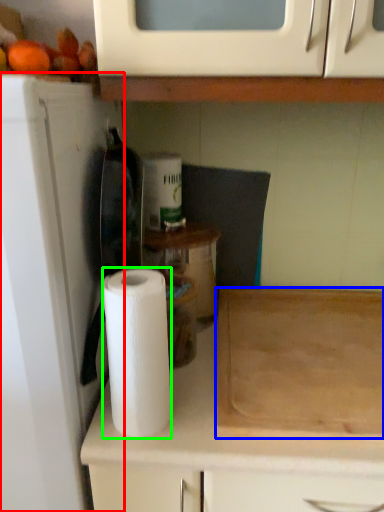
Question: Based on their relative distances, which object is nearer to appliance (highlighted by a red box)? Choose from cutting board (highlighted by a blue box) and paper towel (highlighted by a green box).

Choices:
 (A) cutting board
 (B) paper towel

Answer: (B)